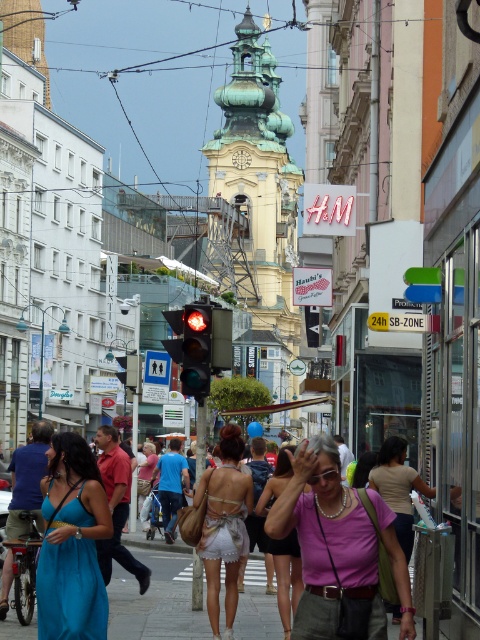
Question: Which of the following is the closest to the observer?

Choices:
 (A) blue satin dress at lower left
 (B) red glass traffic light at center
 (C) blue denim shorts at center

Answer: (A)

Question: Considering the real-world distances, which object is farthest from the white lace dress at center?

Choices:
 (A) red shirt at center
 (B) pink fabric top at center

Answer: (B)

Question: Does matte glass traffic light at center have a lesser width compared to red shirt at center?

Choices:
 (A) no
 (B) yes

Answer: (A)

Question: Does red shirt at center appear under denim shorts at center?

Choices:
 (A) no
 (B) yes

Answer: (A)

Question: Does red shirt at center appear on the right side of matte white dress at center?

Choices:
 (A) no
 (B) yes

Answer: (A)

Question: Among these objects, which one is nearest to the camera?

Choices:
 (A) red shirt at center
 (B) red glass traffic light at center
 (C) denim shorts at center

Answer: (A)